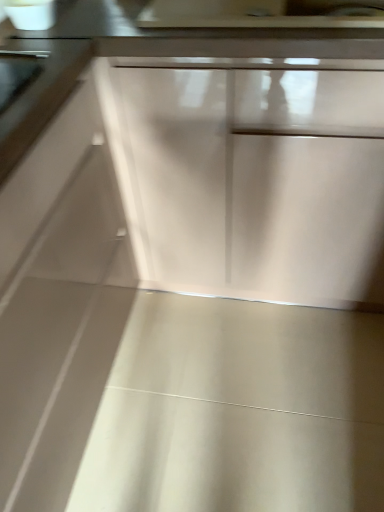
Where is `satin silver handle at upper left`? satin silver handle at upper left is located at coordinates (24, 54).

Describe the element at coordinates (24, 54) in the screenshot. This screenshot has width=384, height=512. I see `satin silver handle at upper left` at that location.

Find the location of a particular element. matte white drawer at center is located at coordinates (252, 181).

What is the approximate width of matte white drawer at center?

It is 23.63 inches.

Describe the element at coordinates (252, 181) in the screenshot. The width and height of the screenshot is (384, 512). I see `matte white drawer at center` at that location.

At what (x,y) coordinates should I click in order to perform the action: click on satin silver handle at upper left. Please return your answer as a coordinate pair (x, y). Looking at the image, I should click on (24, 54).

Between satin silver handle at upper left and matte white drawer at center, which one appears on the right side from the viewer's perspective?

From the viewer's perspective, matte white drawer at center appears more on the right side.

Is satin silver handle at upper left positioned before matte white drawer at center?

No, it is not.

Considering the positions of point (7, 50) and point (145, 158), is point (7, 50) closer or farther from the camera than point (145, 158)?

Point (7, 50) is closer to the camera than point (145, 158).

From the image's perspective, which object appears higher, satin silver handle at upper left or matte white drawer at center?

satin silver handle at upper left appears higher in the image.

From a real-world perspective, is satin silver handle at upper left positioned over matte white drawer at center based on gravity?

Yes, from a real-world perspective, satin silver handle at upper left is on top of matte white drawer at center.

Can you confirm if satin silver handle at upper left is thinner than matte white drawer at center?

Correct, the width of satin silver handle at upper left is less than that of matte white drawer at center.

Between satin silver handle at upper left and matte white drawer at center, which one has more height?

matte white drawer at center.

Is satin silver handle at upper left smaller than matte white drawer at center?

Yes.

Can matte white drawer at center be found inside satin silver handle at upper left?

That's incorrect, matte white drawer at center is not inside satin silver handle at upper left.

Is satin silver handle at upper left touching matte white drawer at center?

There is a gap between satin silver handle at upper left and matte white drawer at center.

Is satin silver handle at upper left facing away from matte white drawer at center?

No, satin silver handle at upper left is not facing the opposite direction of matte white drawer at center.

How different are the orientations of satin silver handle at upper left and matte white drawer at center in degrees?

The facing directions of satin silver handle at upper left and matte white drawer at center are 87 degrees apart.

How far apart are satin silver handle at upper left and matte white drawer at center?

satin silver handle at upper left and matte white drawer at center are 22.10 inches apart from each other.

You are a GUI agent. You are given a task and a screenshot of the screen. Output one action in this format:
    pyautogui.click(x=<x>, y=<y>)
    Task: Click on the door handle located behind the matte white drawer at center
    
    Given the screenshot: What is the action you would take?
    pyautogui.click(x=24, y=54)

Can you confirm if matte white drawer at center is positioned to the left of satin silver handle at upper left?

Incorrect, matte white drawer at center is not on the left side of satin silver handle at upper left.

Looking at this image, is matte white drawer at center behind satin silver handle at upper left?

No, the depth of matte white drawer at center is less than that of satin silver handle at upper left.

Does point (251, 213) come closer to viewer compared to point (8, 51)?

No.

From the image's perspective, does matte white drawer at center appear lower than satin silver handle at upper left?

Yes, from the image's perspective, matte white drawer at center is below satin silver handle at upper left.

From a real-world perspective, is matte white drawer at center physically located above or below satin silver handle at upper left?

Clearly, from a real-world perspective, matte white drawer at center is below satin silver handle at upper left.

Is matte white drawer at center thinner than satin silver handle at upper left?

In fact, matte white drawer at center might be wider than satin silver handle at upper left.

Which of these two, matte white drawer at center or satin silver handle at upper left, stands shorter?

Standing shorter between the two is satin silver handle at upper left.

Considering the sizes of objects matte white drawer at center and satin silver handle at upper left in the image provided, who is smaller, matte white drawer at center or satin silver handle at upper left?

satin silver handle at upper left.

In the scene shown: Is satin silver handle at upper left completely or partially inside matte white drawer at center?

That's incorrect, satin silver handle at upper left is not inside matte white drawer at center.

Is matte white drawer at center in contact with satin silver handle at upper left?

matte white drawer at center and satin silver handle at upper left are clearly separated.

Could you tell me if matte white drawer at center is turned towards satin silver handle at upper left?

Yes, matte white drawer at center is aimed at satin silver handle at upper left.

Where is `door handle on the left of matte white drawer at center`? This screenshot has height=512, width=384. door handle on the left of matte white drawer at center is located at coordinates (24, 54).

Image resolution: width=384 pixels, height=512 pixels. Find the location of `door handle behind the matte white drawer at center`. door handle behind the matte white drawer at center is located at coordinates (24, 54).

Where is `door handle above the matte white drawer at center (from the image's perspective)`? The width and height of the screenshot is (384, 512). door handle above the matte white drawer at center (from the image's perspective) is located at coordinates (24, 54).